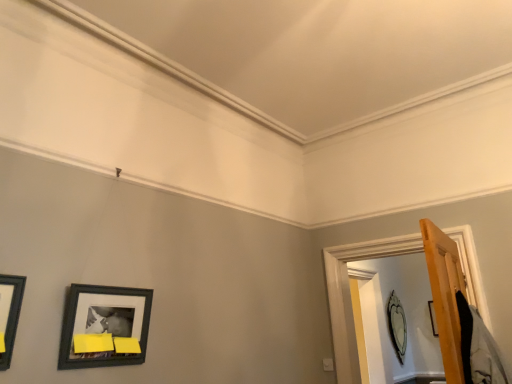
Question: Is matte black picture frame at upper right, which is counted as the second picture frame, starting from the left, further to camera compared to wooden door frame at right?

Choices:
 (A) yes
 (B) no

Answer: (A)

Question: Is matte black picture frame at upper right, which is counted as the 1th picture frame, starting from the bottom, positioned in front of wooden door frame at right?

Choices:
 (A) yes
 (B) no

Answer: (B)

Question: Considering the relative sizes of matte black picture frame at upper right, which is counted as the second picture frame, starting from the left, and wooden door frame at right in the image provided, is matte black picture frame at upper right, which is counted as the second picture frame, starting from the left, smaller than wooden door frame at right?

Choices:
 (A) no
 (B) yes

Answer: (B)

Question: Is matte black picture frame at upper right, which is the second picture frame in front-to-back order, looking in the opposite direction of wooden door frame at right?

Choices:
 (A) yes
 (B) no

Answer: (B)

Question: Is matte black picture frame at upper right, the second picture frame positioned from the top, outside of wooden door frame at right?

Choices:
 (A) no
 (B) yes

Answer: (B)

Question: From a real-world perspective, is matte black picture frame at lower left, which is the 2th picture frame in bottom-to-top order, positioned above or below wooden door frame at right?

Choices:
 (A) below
 (B) above

Answer: (A)

Question: Considering their positions, is matte black picture frame at lower left, which is the first picture frame in top-to-bottom order, located in front of or behind wooden door frame at right?

Choices:
 (A) behind
 (B) front

Answer: (B)

Question: In terms of size, does matte black picture frame at lower left, which is the 1th picture frame from front to back, appear bigger or smaller than wooden door frame at right?

Choices:
 (A) big
 (B) small

Answer: (B)

Question: Choose the correct answer: Is matte black picture frame at lower left, which is the first picture frame in top-to-bottom order, inside wooden door frame at right or outside it?

Choices:
 (A) outside
 (B) inside

Answer: (A)

Question: From their relative heights in the image, would you say matte black picture frame at lower left, which is the first picture frame in top-to-bottom order, is taller or shorter than matte black picture frame at upper right, which is counted as the second picture frame, starting from the left?

Choices:
 (A) tall
 (B) short

Answer: (B)

Question: Is matte black picture frame at lower left, which is the 1th picture frame from front to back, inside the boundaries of matte black picture frame at upper right, positioned as the 1th picture frame in back-to-front order, or outside?

Choices:
 (A) inside
 (B) outside

Answer: (B)

Question: Considering their positions, is matte black picture frame at lower left, arranged as the second picture frame when viewed from the right, located in front of or behind matte black picture frame at upper right, which is the second picture frame in front-to-back order?

Choices:
 (A) behind
 (B) front

Answer: (B)

Question: Considering the positions of matte black picture frame at lower left, which is the 2th picture frame in bottom-to-top order, and matte black picture frame at upper right, which is counted as the second picture frame, starting from the left, in the image, is matte black picture frame at lower left, which is the 2th picture frame in bottom-to-top order, wider or thinner than matte black picture frame at upper right, which is counted as the second picture frame, starting from the left,?

Choices:
 (A) thin
 (B) wide

Answer: (B)

Question: Is wooden door frame at right to the left or to the right of matte black picture frame at upper right, the first picture frame viewed from the right, in the image?

Choices:
 (A) left
 (B) right

Answer: (A)

Question: From a real-world perspective, is wooden door frame at right physically located above or below matte black picture frame at upper right, which is the second picture frame in front-to-back order?

Choices:
 (A) below
 (B) above

Answer: (B)